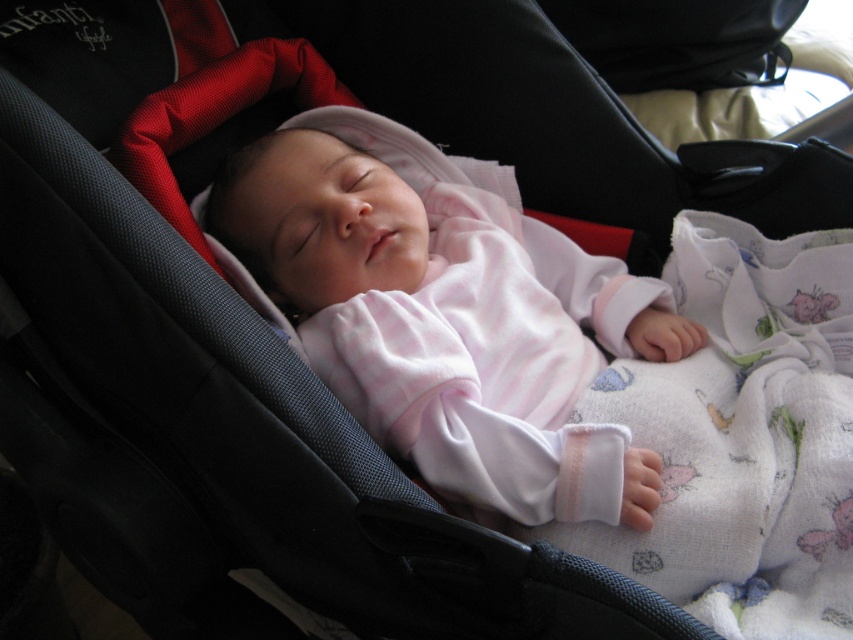
Does pink soft fabric baby at center lie in front of white cotton blanket at lower right?

No.

Where is `pink soft fabric baby at center`? pink soft fabric baby at center is located at coordinates (450, 314).